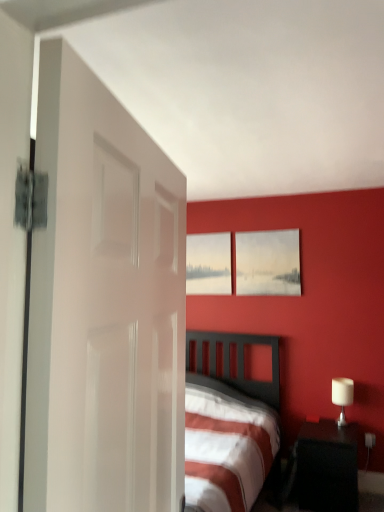
Question: From a real-world perspective, is matte white picture frame at upper center, the 2th picture frame when ordered from left to right, positioned under white glossy table lamp at right based on gravity?

Choices:
 (A) no
 (B) yes

Answer: (A)

Question: Considering the relative sizes of matte white picture frame at upper center, the first picture frame when ordered from front to back, and white glossy table lamp at right in the image provided, is matte white picture frame at upper center, the first picture frame when ordered from front to back, bigger than white glossy table lamp at right?

Choices:
 (A) yes
 (B) no

Answer: (A)

Question: From the image's perspective, is matte white picture frame at upper center, the 1th picture frame from the right, located beneath white glossy table lamp at right?

Choices:
 (A) yes
 (B) no

Answer: (B)

Question: Can you confirm if matte white picture frame at upper center, the first picture frame when ordered from front to back, is smaller than white glossy table lamp at right?

Choices:
 (A) no
 (B) yes

Answer: (A)

Question: Is matte white picture frame at upper center, the 2th picture frame when ordered from back to front, positioned far away from white glossy table lamp at right?

Choices:
 (A) yes
 (B) no

Answer: (A)

Question: Would you say matte white picture frame at upper center, the 2th picture frame when ordered from left to right, is outside white glossy table lamp at right?

Choices:
 (A) yes
 (B) no

Answer: (A)

Question: From a real-world perspective, is white glossy door at left on black glossy nightstand at lower right?

Choices:
 (A) no
 (B) yes

Answer: (B)

Question: From a real-world perspective, is white glossy door at left under black glossy nightstand at lower right?

Choices:
 (A) no
 (B) yes

Answer: (A)

Question: Is white glossy door at left not close to black glossy nightstand at lower right?

Choices:
 (A) yes
 (B) no

Answer: (A)

Question: Is white glossy door at left bigger than black glossy nightstand at lower right?

Choices:
 (A) no
 (B) yes

Answer: (A)

Question: From the image's perspective, is white glossy door at left on top of black glossy nightstand at lower right?

Choices:
 (A) no
 (B) yes

Answer: (B)

Question: From the image's perspective, is white glossy door at left located beneath black glossy nightstand at lower right?

Choices:
 (A) no
 (B) yes

Answer: (A)

Question: Considering the relative positions of matte gray picture frame at upper center, the first picture frame positioned from the back, and white glossy table lamp at right in the image provided, is matte gray picture frame at upper center, the first picture frame positioned from the back, to the left of white glossy table lamp at right from the viewer's perspective?

Choices:
 (A) no
 (B) yes

Answer: (B)